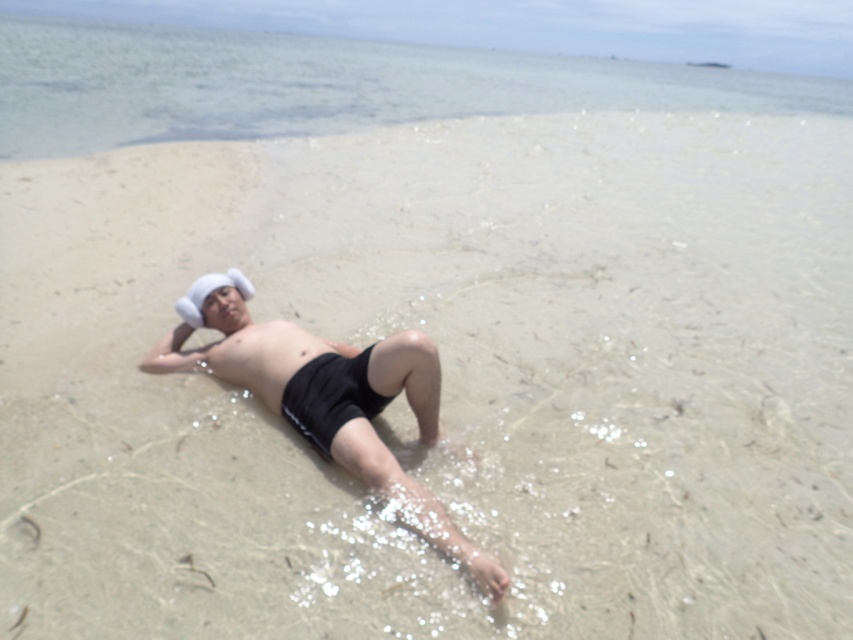
You are a lifeguard on duty and notice a swimmer submerged in the clear water at upper center. Can you see the smooth skin stomach at center of the swimmer from your vantage point?

Yes, because the clear water at upper center allows visibility of the sandy bottom beneath, you can see the smooth skin stomach at center of the swimmer through the water.

You are a lifeguard on duty and notice a swimmer struggling in the clear water at upper center. You are standing at the edge of the beach near the matte black shorts at center. Which direction should you move to reach the swimmer quickly?

The clear water at upper center is located above the matte black shorts at center, so you should move forward towards the direction of the clear water at upper center to reach the swimmer quickly.